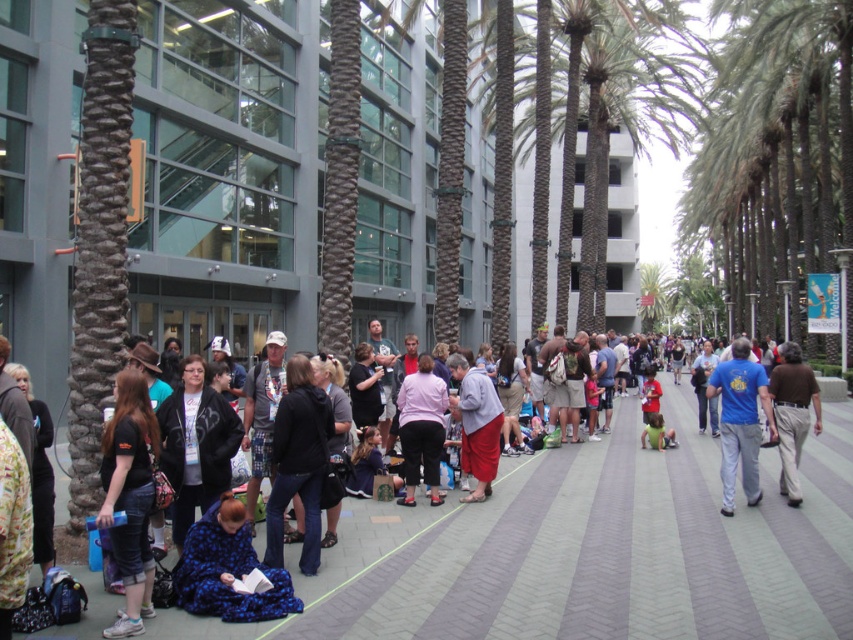
You are standing at the point closer to the camera between the two points, point (721, 458) and point (817, 394). Which point are you standing at?

You are standing at point (721, 458) because it is further to the camera than point (817, 394).